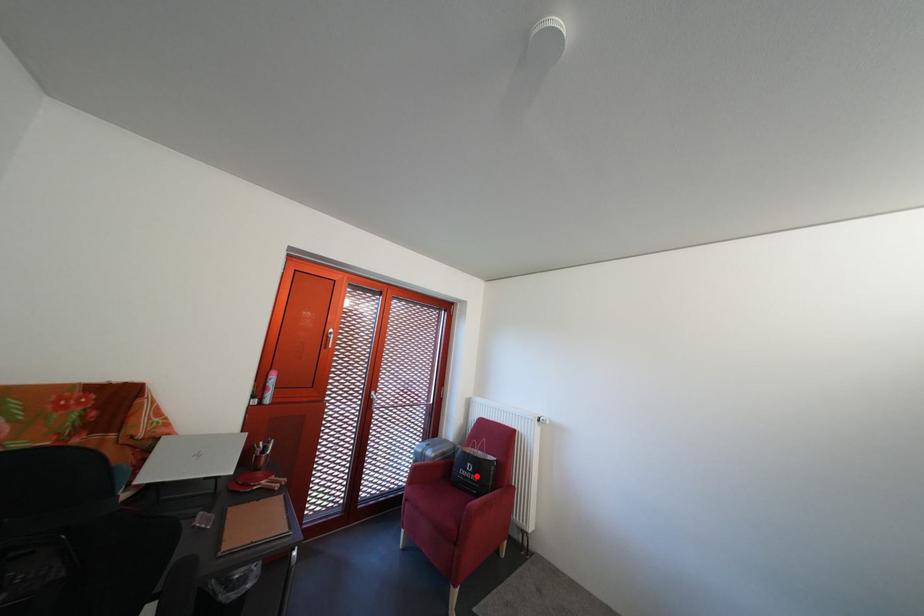
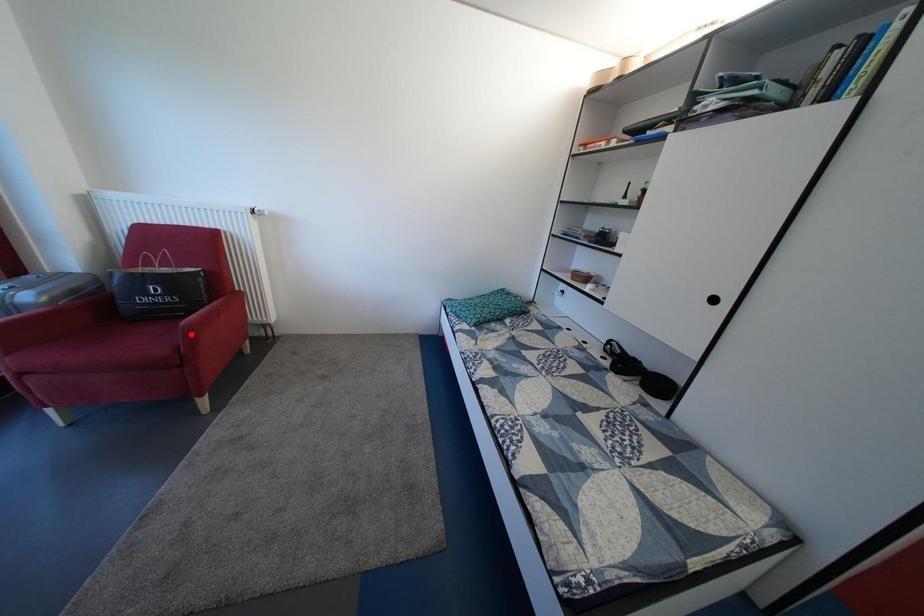
I am providing you with two images of the same scene from different viewpoints. A red point is marked on the first image and another point is marked on the second image. Is the red point in image1 aligned with the point shown in image2?

No